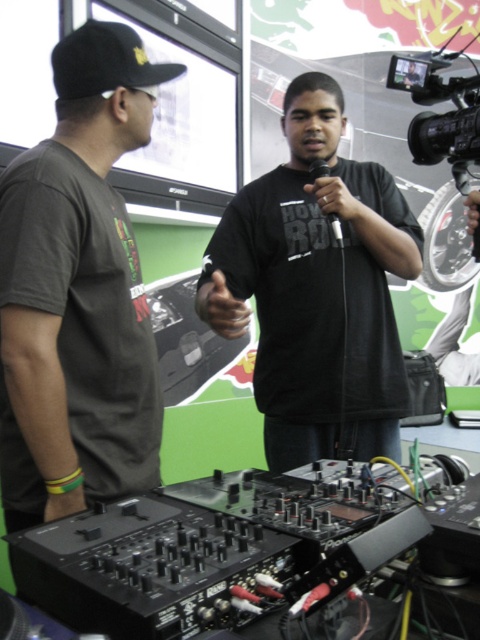
Question: Can you confirm if dark gray t-shirt at left is positioned to the left of black matte baseball cap at upper left?

Choices:
 (A) no
 (B) yes

Answer: (B)

Question: Which point is farther to the camera?

Choices:
 (A) black matte shirt at center
 (B) dark gray t-shirt at left
 (C) black plastic video camera at upper right

Answer: (C)

Question: Can you confirm if black matte shirt at center is positioned below black plastic video camera at upper right?

Choices:
 (A) yes
 (B) no

Answer: (A)

Question: Based on their relative distances, which object is nearer to the black matte shirt at center?

Choices:
 (A) black plastic video camera at upper right
 (B) black matte baseball cap at upper left
 (C) dark gray t-shirt at left

Answer: (A)

Question: Does black matte shirt at center appear over black matte baseball cap at upper left?

Choices:
 (A) no
 (B) yes

Answer: (A)

Question: Among these points, which one is nearest to the camera?

Choices:
 (A) (93, 96)
 (B) (61, 445)
 (C) (300, 420)
 (D) (448, 52)

Answer: (B)